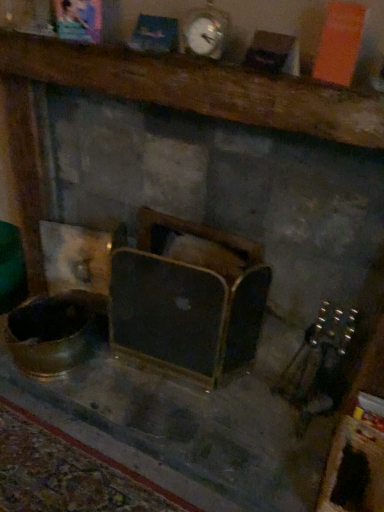
Question: Which direction should I rotate to look at wooden framed mirror at center, which is counted as the 2th furniture, starting from the top, — up or down?

Choices:
 (A) down
 (B) up

Answer: (A)

Question: Is metallic silver clock at upper center in contact with wooden mantel at upper center, which is the first furniture from top to bottom?

Choices:
 (A) yes
 (B) no

Answer: (B)

Question: Is metallic silver clock at upper center not near wooden mantel at upper center, which is counted as the 2th furniture, starting from the bottom?

Choices:
 (A) no
 (B) yes

Answer: (A)

Question: Is metallic silver clock at upper center positioned beyond the bounds of wooden mantel at upper center, which is the first furniture from top to bottom?

Choices:
 (A) yes
 (B) no

Answer: (A)

Question: From a real-world perspective, is metallic silver clock at upper center on wooden mantel at upper center, which is counted as the 2th furniture, starting from the bottom?

Choices:
 (A) no
 (B) yes

Answer: (B)

Question: Does metallic silver clock at upper center appear on the right side of wooden mantel at upper center, which is the first furniture from top to bottom?

Choices:
 (A) no
 (B) yes

Answer: (B)

Question: From the image's perspective, is metallic silver clock at upper center under wooden mantel at upper center, which is counted as the 2th furniture, starting from the bottom?

Choices:
 (A) no
 (B) yes

Answer: (A)

Question: Is wooden mantel at upper center, which is counted as the 2th furniture, starting from the bottom, touching wooden framed mirror at center, which is counted as the 2th furniture, starting from the top?

Choices:
 (A) no
 (B) yes

Answer: (A)

Question: Considering the relative positions of wooden mantel at upper center, which is the first furniture from top to bottom, and wooden framed mirror at center, placed as the first furniture when sorted from bottom to top, in the image provided, is wooden mantel at upper center, which is the first furniture from top to bottom, behind wooden framed mirror at center, placed as the first furniture when sorted from bottom to top,?

Choices:
 (A) no
 (B) yes

Answer: (A)

Question: Is wooden mantel at upper center, which is the first furniture from top to bottom, to the left of wooden framed mirror at center, which is counted as the 2th furniture, starting from the top, from the viewer's perspective?

Choices:
 (A) yes
 (B) no

Answer: (B)

Question: From a real-world perspective, is wooden mantel at upper center, which is the first furniture from top to bottom, on wooden framed mirror at center, which is counted as the 2th furniture, starting from the top?

Choices:
 (A) no
 (B) yes

Answer: (B)

Question: Can you confirm if wooden mantel at upper center, which is counted as the 2th furniture, starting from the bottom, is bigger than wooden framed mirror at center, which is counted as the 2th furniture, starting from the top?

Choices:
 (A) yes
 (B) no

Answer: (A)

Question: Is wooden mantel at upper center, which is the first furniture from top to bottom, positioned before wooden framed mirror at center, which is counted as the 2th furniture, starting from the top?

Choices:
 (A) no
 (B) yes

Answer: (B)

Question: From the image's perspective, is metallic silver clock at upper center over wooden framed mirror at center, which is counted as the 2th furniture, starting from the top?

Choices:
 (A) no
 (B) yes

Answer: (B)